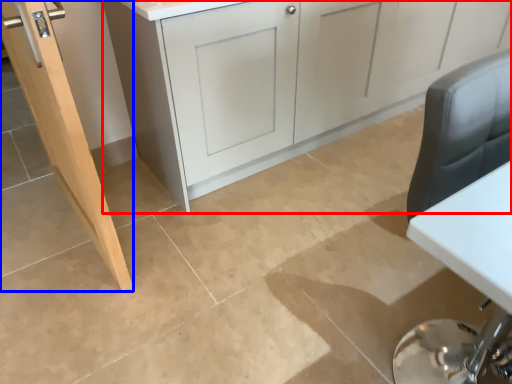
Question: Among these objects, which one is nearest to the camera, cabinetry (highlighted by a red box) or door (highlighted by a blue box)?

Choices:
 (A) cabinetry
 (B) door

Answer: (B)